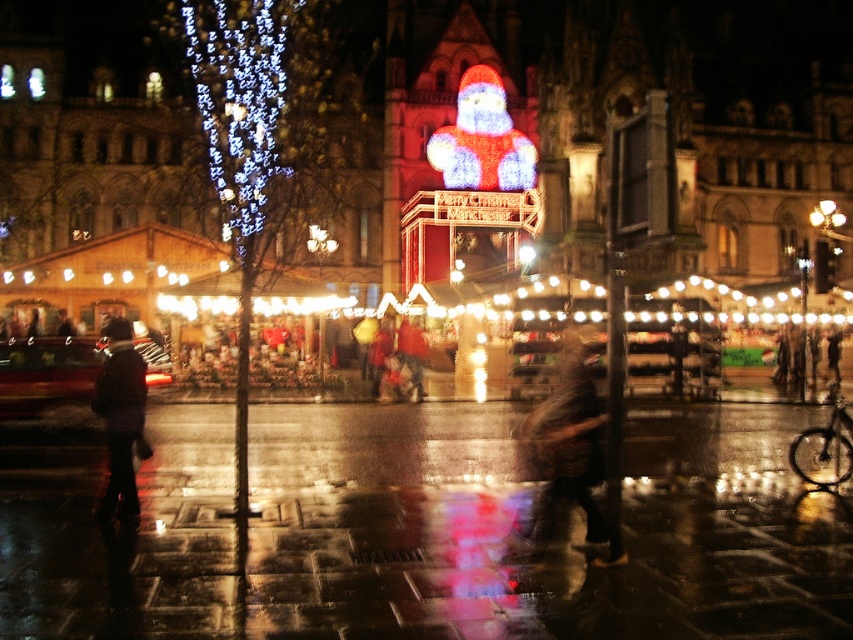
The width and height of the screenshot is (853, 640). I want to click on white string lights at center, so click(x=316, y=307).

What do you see at coordinates (316, 307) in the screenshot?
I see `white string lights at center` at bounding box center [316, 307].

Locate an element on the screen. white string lights at center is located at coordinates (316, 307).

You are a GUI agent. You are given a task and a screenshot of the screen. Output one action in this format:
    pyautogui.click(x=<x>, y=<y>)
    Task: Click on the white string lights at center
    The image size is (853, 640).
    Given the screenshot: What is the action you would take?
    pyautogui.click(x=316, y=307)

Measure the distance between point (532, 161) and camera.

Point (532, 161) and camera are 101.47 meters apart from each other.

Can you confirm if illuminated fabric santa at center is bigger than dark fabric coat at lower left?

Actually, illuminated fabric santa at center might be smaller than dark fabric coat at lower left.

Describe the element at coordinates (482, 140) in the screenshot. I see `illuminated fabric santa at center` at that location.

You are a GUI agent. You are given a task and a screenshot of the screen. Output one action in this format:
    pyautogui.click(x=<x>, y=<y>)
    Task: Click on the illuminated fabric santa at center
    The width and height of the screenshot is (853, 640).
    Given the screenshot: What is the action you would take?
    pyautogui.click(x=482, y=140)

From the picture: Which of these two, brown leather jacket at center or illuminated fabric santa at center, stands shorter?

With less height is brown leather jacket at center.

Can you confirm if brown leather jacket at center is positioned to the left of illuminated fabric santa at center?

No, brown leather jacket at center is not to the left of illuminated fabric santa at center.

Image resolution: width=853 pixels, height=640 pixels. What do you see at coordinates (572, 449) in the screenshot? I see `brown leather jacket at center` at bounding box center [572, 449].

Locate an element on the screen. The height and width of the screenshot is (640, 853). brown leather jacket at center is located at coordinates (572, 449).